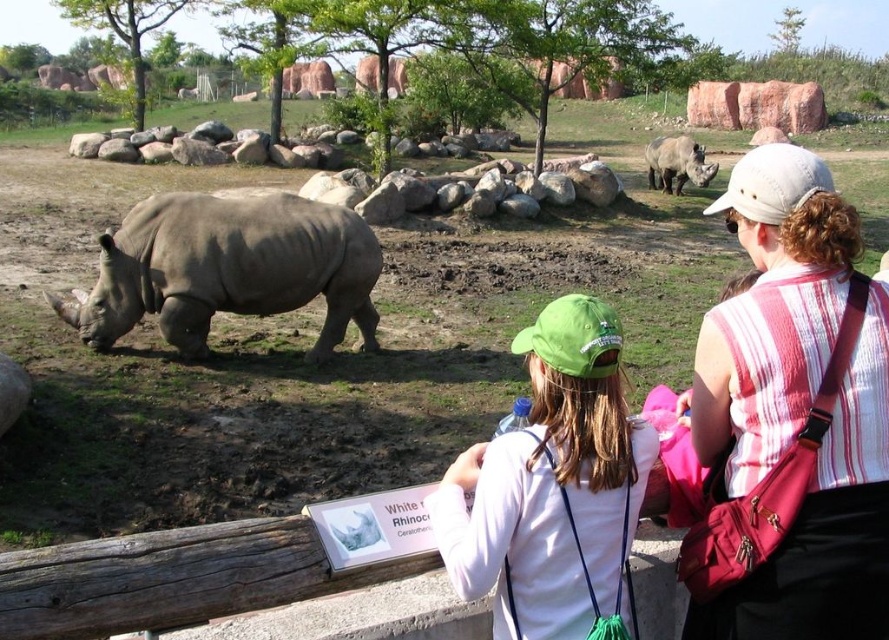
Based on the coordinates provided, which animal is located at point [229,268] in the scene?

The gray matte rhinoceros at left is located at point [229,268].

You are a zookeeper trying to determine which rhinoceros is closer to the entrance located at the right side of the enclosure. You see the gray matte rhinoceros at left and the gray matte rhinoceros at center. Which one is closer to the entrance?

The gray matte rhinoceros at center is closer to the entrance located at the right side of the enclosure than the gray matte rhinoceros at left.